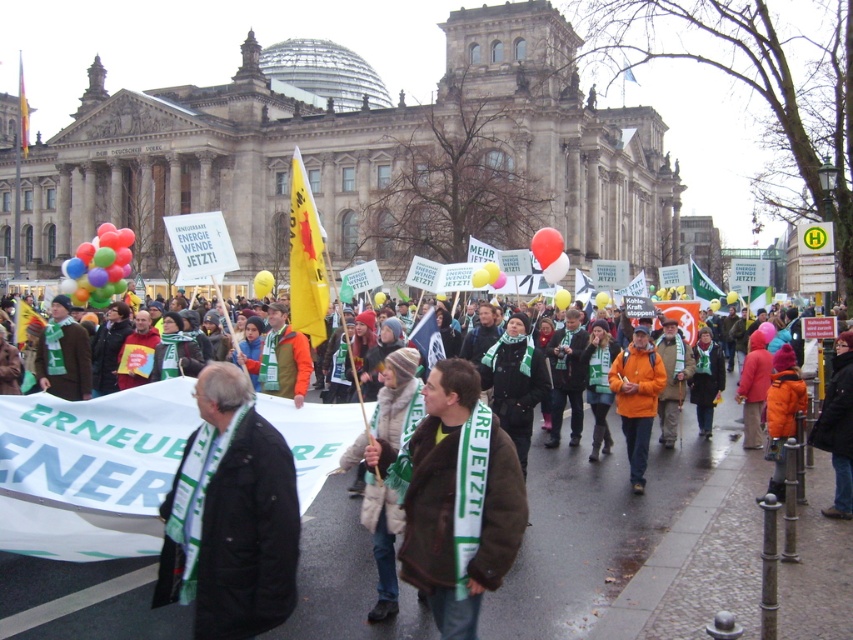
Based on the photo, is orange matte jacket at center to the right of brown wool scarf at center from the viewer's perspective?

Indeed, orange matte jacket at center is positioned on the right side of brown wool scarf at center.

Find the location of `orange matte jacket at center`. orange matte jacket at center is located at coordinates (636, 397).

Is black fabric jacket at center to the right of translucent red balloon at center from the viewer's perspective?

No, black fabric jacket at center is not to the right of translucent red balloon at center.

Can you confirm if black fabric jacket at center is thinner than translucent red balloon at center?

No.

Is point (167, 554) positioned behind point (555, 252)?

No, (167, 554) is in front of (555, 252).

Identify the location of black fabric jacket at center. (230, 516).

Is green scarf at center bigger than translucent red balloon at center?

Yes, green scarf at center is bigger than translucent red balloon at center.

Can you confirm if green scarf at center is smaller than translucent red balloon at center?

Actually, green scarf at center might be larger than translucent red balloon at center.

Who is more distant from viewer, (392, 372) or (537, 244)?

The point (537, 244) is more distant.

Locate an element on the screen. This screenshot has height=640, width=853. green scarf at center is located at coordinates (392, 404).